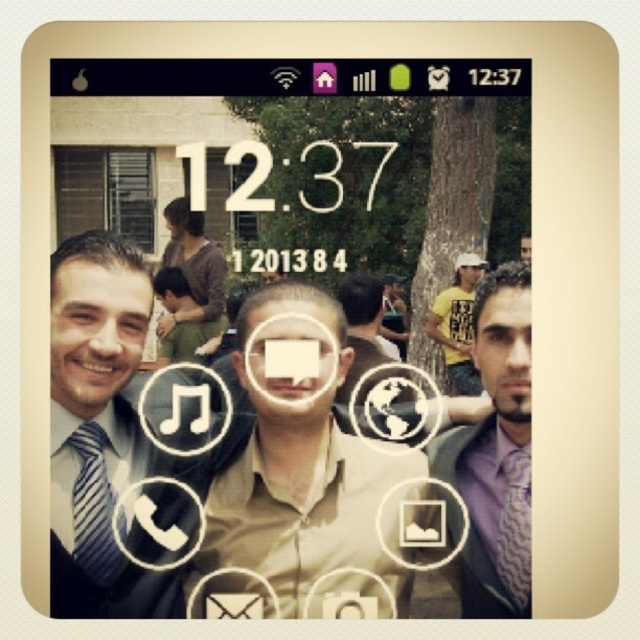
Does point (97, 461) come closer to viewer compared to point (472, 282)?

No.

Is striped tie at left closer to camera compared to smooth skin face at center?

Yes, striped tie at left is in front of smooth skin face at center.

Locate an element on the screen. The height and width of the screenshot is (640, 640). striped tie at left is located at coordinates pyautogui.click(x=99, y=429).

Is striped tie at left closer to the viewer compared to green fabric shirt at center?

Yes, striped tie at left is in front of green fabric shirt at center.

Can you confirm if striped tie at left is positioned below green fabric shirt at center?

Yes.

Image resolution: width=640 pixels, height=640 pixels. Find the location of `striped tie at left`. striped tie at left is located at coordinates (99, 429).

Is point (324, 349) positioned behind point (472, 269)?

That is True.

How far apart are white matte face at center and smooth skin face at center?

70.41 centimeters

Where is `white matte face at center`? The height and width of the screenshot is (640, 640). white matte face at center is located at coordinates (291, 358).